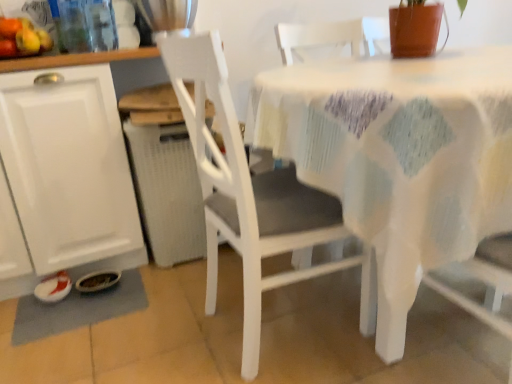
Identify the location of vacant space situated above gray fabric place mat at lower left (from a real-world perspective). The height and width of the screenshot is (384, 512). (87, 302).